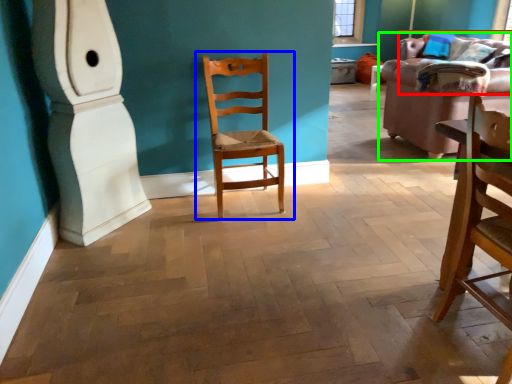
Question: Estimate the real-world distances between objects in this image. Which object is farther from couch (highlighted by a red box), chair (highlighted by a blue box) or studio couch (highlighted by a green box)?

Choices:
 (A) chair
 (B) studio couch

Answer: (A)